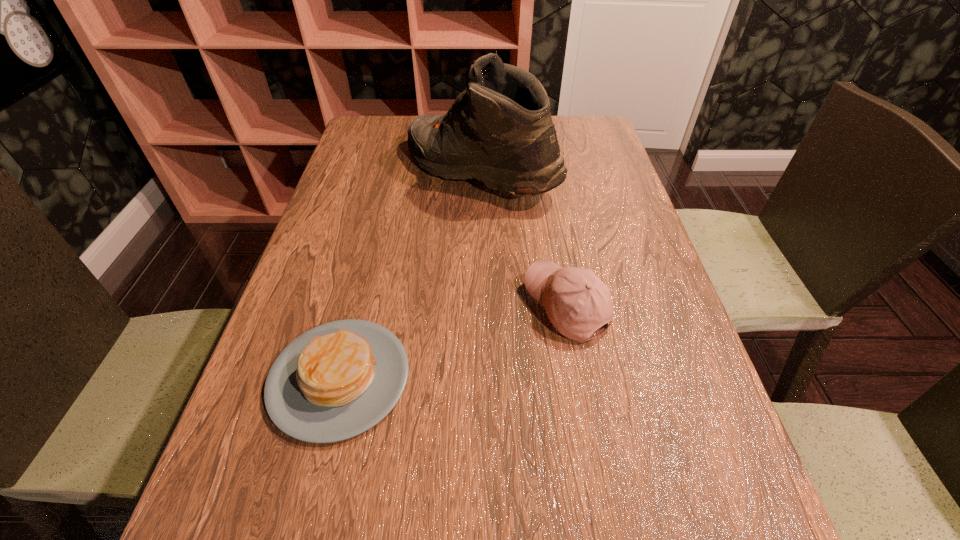
At what (x,y) coordinates should I click in order to perform the action: click on the tallest object. Please return your answer as a coordinate pair (x, y). Looking at the image, I should click on (499, 130).

This screenshot has height=540, width=960. Find the location of `the farthest object`. the farthest object is located at coordinates (499, 130).

Identify the location of baseball cap. [x=577, y=302].

Where is `the shortest object`? This screenshot has width=960, height=540. the shortest object is located at coordinates point(336,381).

You are a GUI agent. You are given a task and a screenshot of the screen. Output one action in this format:
    pyautogui.click(x=<x>, y=<y>)
    Task: Click on the free spot located 0.310m on the front of the ski boot
    This screenshot has width=960, height=540.
    Given the screenshot: What is the action you would take?
    pyautogui.click(x=480, y=318)

Image resolution: width=960 pixels, height=540 pixels. Find the location of `blank space located 0.130m on the front-facing side of the baseball cap`. blank space located 0.130m on the front-facing side of the baseball cap is located at coordinates (457, 307).

You are a GUI agent. You are given a task and a screenshot of the screen. Output one action in this format:
    pyautogui.click(x=<x>, y=<y>)
    Task: Click on the free space located on the front-facing side of the baseball cap
    This screenshot has height=540, width=960.
    Given the screenshot: What is the action you would take?
    (442, 307)

Locate an element on the screen. The image size is (960, 540). free spot located 0.210m on the front-facing side of the baseball cap is located at coordinates (416, 307).

This screenshot has width=960, height=540. Find the location of `free location located on the right of the shortest object`. free location located on the right of the shortest object is located at coordinates (593, 378).

Find the location of a particular element. This screenshot has width=960, height=540. object present at the far edge is located at coordinates (499, 130).